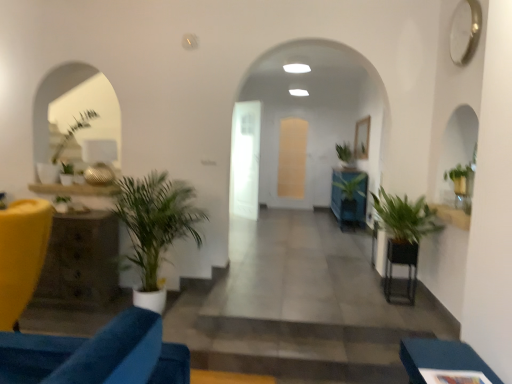
In order to click on free space to the left of black metal table at lower right, acting as the 2th table starting from the left in this screenshot , I will do `click(371, 297)`.